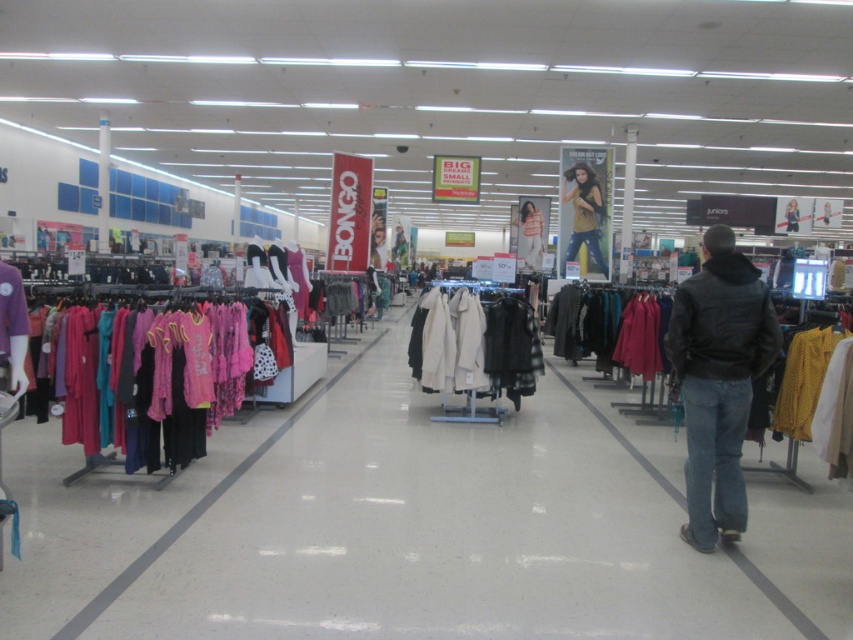
You are a customer in the store and want to pick up both the black leather jacket at right and the black leather jacket at center. Which jacket should you approach first if you are standing in the aisle facing the racks?

You should approach the black leather jacket at right first because it is to the left of the black leather jacket at center. Since you are facing the racks, the jacket on the right side of your view would actually be positioned to the left of the center jacket, so you would reach it first by moving along the aisle.

From the picture: You are a customer in the store and want to find the black leather jacket at right. If the store aisle is represented as a coordinate system with the entrance at the origin, where would you look relative to the entrance?

The black leather jacket at right is located at coordinates approximately 0.595 on the x and 0.843 on the y axis relative to the entrance.